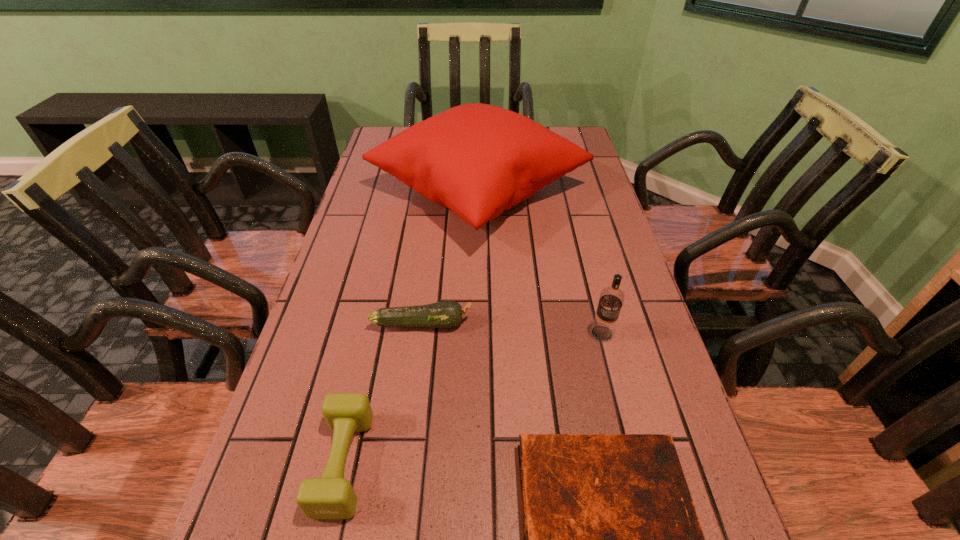
Locate an element on the screen. Image resolution: width=960 pixels, height=540 pixels. cushion that is at the left edge is located at coordinates (476, 159).

Image resolution: width=960 pixels, height=540 pixels. Find the location of `dumbbell located in the left edge section of the desktop`. dumbbell located in the left edge section of the desktop is located at coordinates (331, 496).

This screenshot has height=540, width=960. Find the location of `zucchini that is at the left edge`. zucchini that is at the left edge is located at coordinates (446, 314).

Locate an element on the screen. cushion situated at the right edge is located at coordinates (476, 159).

At what (x,y) coordinates should I click in order to perform the action: click on vodka at the right edge. Please return your answer as a coordinate pair (x, y). Looking at the image, I should click on (611, 299).

Find the location of a particular element. The height and width of the screenshot is (540, 960). object positioned at the far left corner is located at coordinates (476, 159).

Where is `object situated at the far right corner`? This screenshot has height=540, width=960. object situated at the far right corner is located at coordinates (476, 159).

This screenshot has width=960, height=540. Identify the location of vacant area at the left edge. (352, 270).

Image resolution: width=960 pixels, height=540 pixels. Identify the location of blank space at the right edge. (598, 286).

Where is `free space at the far left corner`? free space at the far left corner is located at coordinates (387, 137).